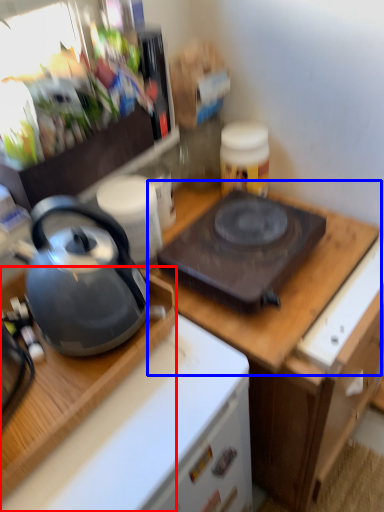
Question: Which of the following is the closest to the observer, desk (highlighted by a red box) or counter top (highlighted by a blue box)?

Choices:
 (A) desk
 (B) counter top

Answer: (A)